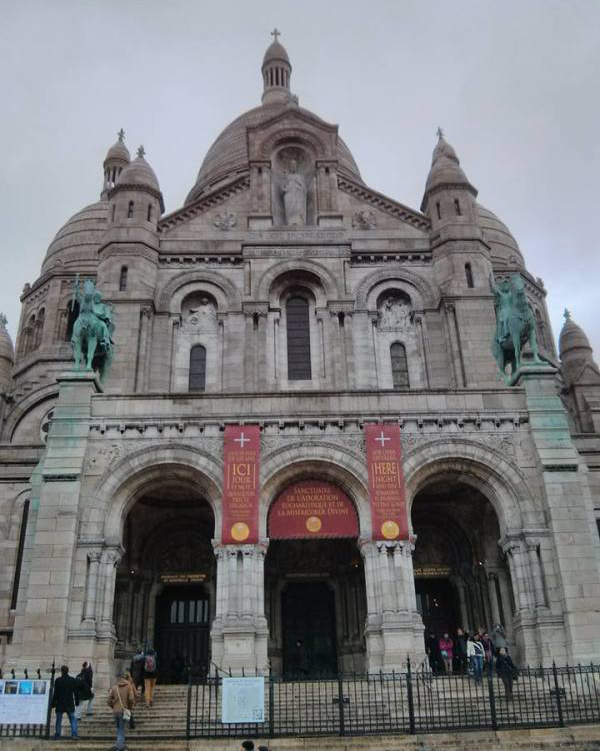
Where is `black rectangular shaped door`? The height and width of the screenshot is (751, 600). black rectangular shaped door is located at coordinates (309, 619).